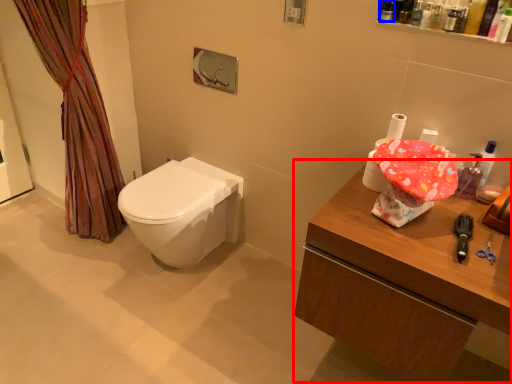
Question: Which of the following is the closest to the observer, counter (highlighted by a red box) or toiletry (highlighted by a blue box)?

Choices:
 (A) counter
 (B) toiletry

Answer: (A)